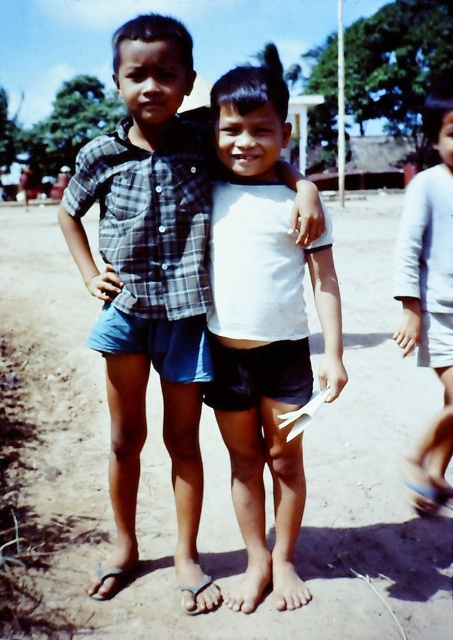
Question: Does plaid fabric shirt at center have a lesser width compared to white matte shirt at center?

Choices:
 (A) no
 (B) yes

Answer: (A)

Question: Based on their relative distances, which object is farther from the white fabric dress at right?

Choices:
 (A) brown sandy ground at center
 (B) white matte shirt at center
 (C) plaid fabric shirt at center

Answer: (A)

Question: Is brown sandy ground at center above plaid fabric shirt at center?

Choices:
 (A) no
 (B) yes

Answer: (B)

Question: Among these points, which one is farthest from the camera?

Choices:
 (A) (244, 340)
 (B) (95, 164)
 (C) (422, 481)
 (D) (145, 618)

Answer: (C)

Question: Is brown sandy ground at center above plaid fabric shirt at center?

Choices:
 (A) yes
 (B) no

Answer: (A)

Question: Considering the real-world distances, which object is closest to the white fabric dress at right?

Choices:
 (A) brown sandy ground at center
 (B) white matte shirt at center
 (C) plaid fabric shirt at center

Answer: (B)